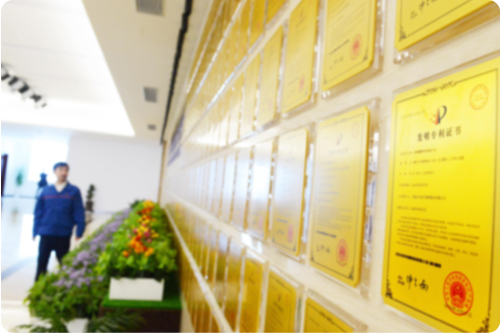
Where is `wall`? wall is located at coordinates (102, 167).